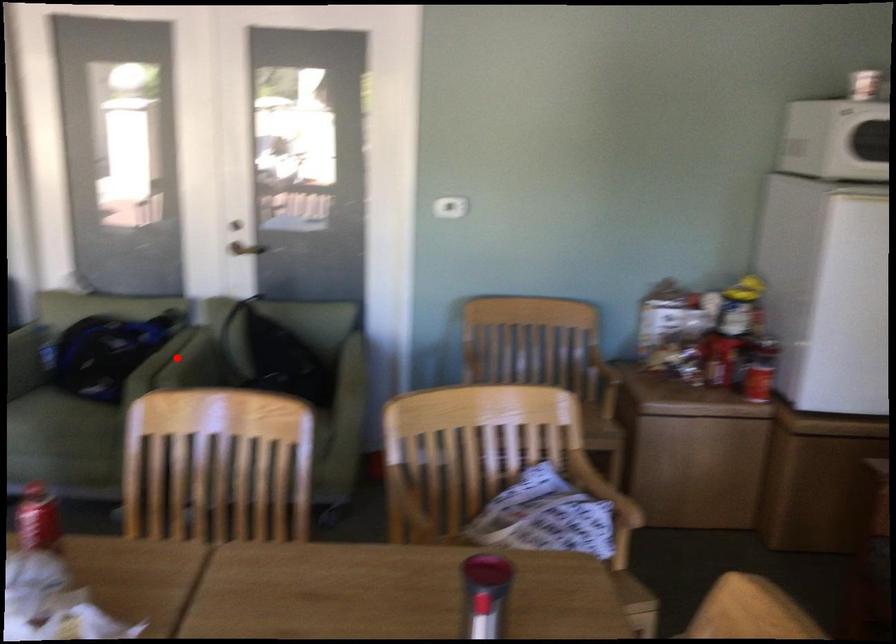
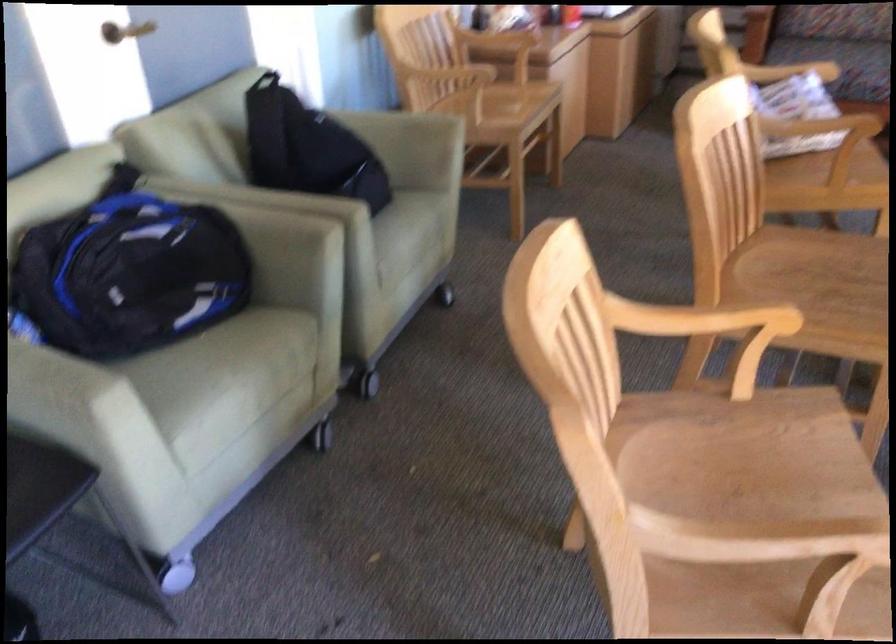
The point at the highlighted location is marked in the first image. Where is the corresponding point in the second image?

(250, 194)